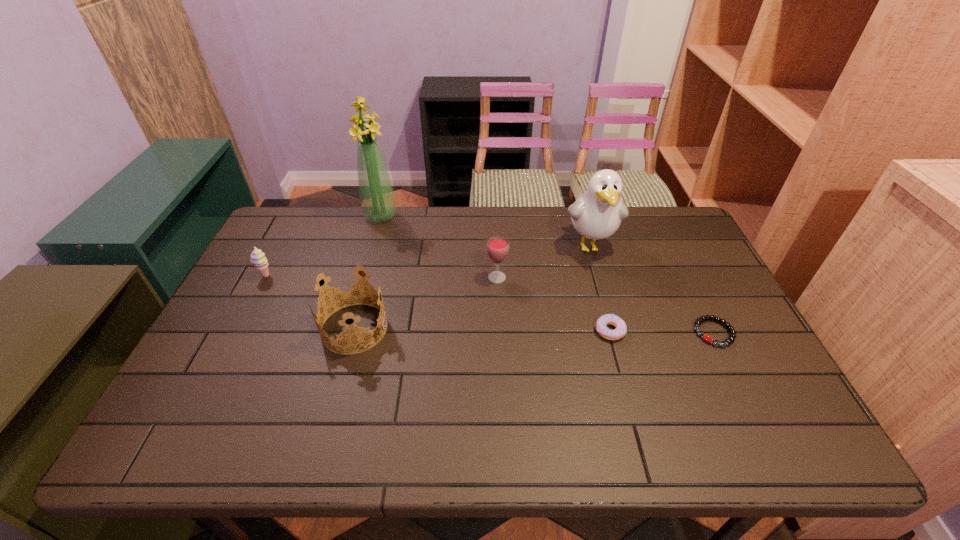
This screenshot has width=960, height=540. Identify the location of free spot at the far edge of the desktop. 536,217.

Identify the location of free region at the near edge. Image resolution: width=960 pixels, height=540 pixels. (247, 422).

Identify the location of free space at the left edge of the desktop. (x=218, y=369).

At what (x,y) coordinates should I click in order to perform the action: click on vacant space at the right edge. Please return your answer as a coordinate pair (x, y). The width and height of the screenshot is (960, 540). Looking at the image, I should click on (748, 392).

This screenshot has height=540, width=960. In the image, there is a desktop. What are the coordinates of `vacant area at the far left corner` in the screenshot? It's located at (289, 242).

I want to click on free spot at the far right corner of the desktop, so click(x=681, y=216).

At what (x,y) coordinates should I click in order to perform the action: click on free spot between the rightmost object and the wineglass. Please return your answer as a coordinate pair (x, y). The width and height of the screenshot is (960, 540). Looking at the image, I should click on (606, 305).

This screenshot has width=960, height=540. In order to click on free space between the shortest object and the fourth object from right to left in this screenshot , I will do `click(606, 305)`.

You are a GUI agent. You are given a task and a screenshot of the screen. Output one action in this format:
    pyautogui.click(x=<x>, y=<y>)
    Task: Click on the vacant area between the fourth object from left to right and the third shortest object
    Image resolution: width=960 pixels, height=540 pixels.
    Given the screenshot: What is the action you would take?
    pyautogui.click(x=381, y=276)

Locate an element on the screen. The height and width of the screenshot is (540, 960). vacant region between the doughnut and the sixth shortest object is located at coordinates (600, 288).